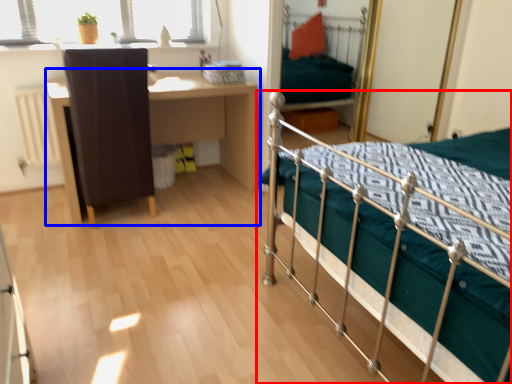
Question: Among these objects, which one is farthest to the camera, bed (highlighted by a red box) or desk (highlighted by a blue box)?

Choices:
 (A) bed
 (B) desk

Answer: (B)